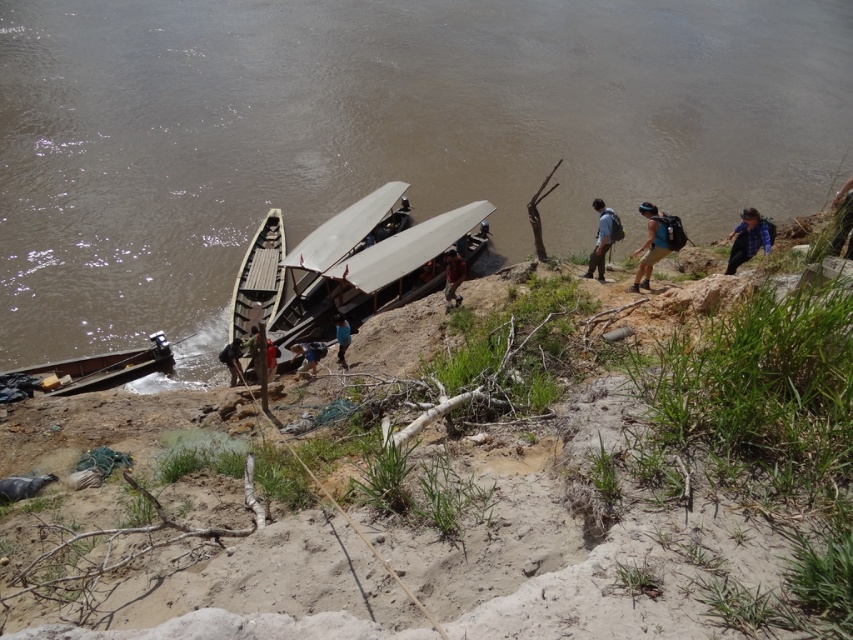
Does point (740, 259) lie in front of point (450, 298)?

Yes, point (740, 259) is in front of point (450, 298).

Is blue fabric backpack at upper right to the left of brown fabric shirt at center from the viewer's perspective?

In fact, blue fabric backpack at upper right is to the right of brown fabric shirt at center.

Is point (750, 212) farther from viewer compared to point (447, 300)?

That is False.

Image resolution: width=853 pixels, height=640 pixels. I want to click on blue fabric backpack at upper right, so click(747, 237).

Can you confirm if blue backpack at center is thinner than blue fabric shirt at lower center?

No.

Which is more to the right, blue backpack at center or blue fabric shirt at lower center?

Positioned to the right is blue backpack at center.

You are a GUI agent. You are given a task and a screenshot of the screen. Output one action in this format:
    pyautogui.click(x=<x>, y=<y>)
    Task: Click on the blue backpack at center
    
    Given the screenshot: What is the action you would take?
    pyautogui.click(x=650, y=244)

Locate an element on the screen. blue backpack at center is located at coordinates (650, 244).

From the picture: Can you confirm if blue fabric shirt at lower center is bigger than blue fabric person at center?

Correct, blue fabric shirt at lower center is larger in size than blue fabric person at center.

Can you confirm if blue fabric shirt at lower center is positioned to the left of blue fabric person at center?

Indeed, blue fabric shirt at lower center is positioned on the left side of blue fabric person at center.

Looking at this image, who is more forward, (x=311, y=353) or (x=343, y=324)?

Positioned in front is point (x=343, y=324).

Where is `blue fabric shirt at lower center`? This screenshot has width=853, height=640. blue fabric shirt at lower center is located at coordinates (310, 353).